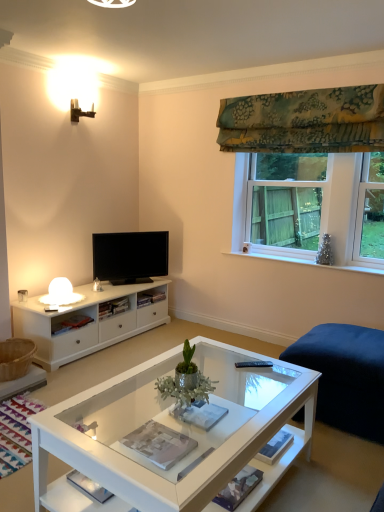
Question: From the image's perspective, is white glass coffee table at center on top of green metallic plant at center?

Choices:
 (A) no
 (B) yes

Answer: (A)

Question: Is white glass coffee table at center shorter than green metallic plant at center?

Choices:
 (A) yes
 (B) no

Answer: (A)

Question: Can you confirm if white glass coffee table at center is positioned to the left of green metallic plant at center?

Choices:
 (A) no
 (B) yes

Answer: (B)

Question: Is white glass coffee table at center far away from green metallic plant at center?

Choices:
 (A) yes
 (B) no

Answer: (B)

Question: Would you say white glass coffee table at center contains green metallic plant at center?

Choices:
 (A) yes
 (B) no

Answer: (B)

Question: Is white glass coffee table at center oriented away from green metallic plant at center?

Choices:
 (A) yes
 (B) no

Answer: (B)

Question: Does black glossy tv at center come in front of green floral fabric at upper right?

Choices:
 (A) no
 (B) yes

Answer: (A)

Question: Is black glossy tv at center at the left side of green floral fabric at upper right?

Choices:
 (A) no
 (B) yes

Answer: (B)

Question: Could you tell me if black glossy tv at center is facing green floral fabric at upper right?

Choices:
 (A) yes
 (B) no

Answer: (B)

Question: Does black glossy tv at center have a smaller size compared to green floral fabric at upper right?

Choices:
 (A) yes
 (B) no

Answer: (A)

Question: Is black glossy tv at center taller than green floral fabric at upper right?

Choices:
 (A) no
 (B) yes

Answer: (A)

Question: From the image's perspective, is black glossy tv at center on green floral fabric at upper right?

Choices:
 (A) yes
 (B) no

Answer: (B)

Question: Does green floral fabric at upper right have a smaller size compared to clear glass window at upper right?

Choices:
 (A) yes
 (B) no

Answer: (A)